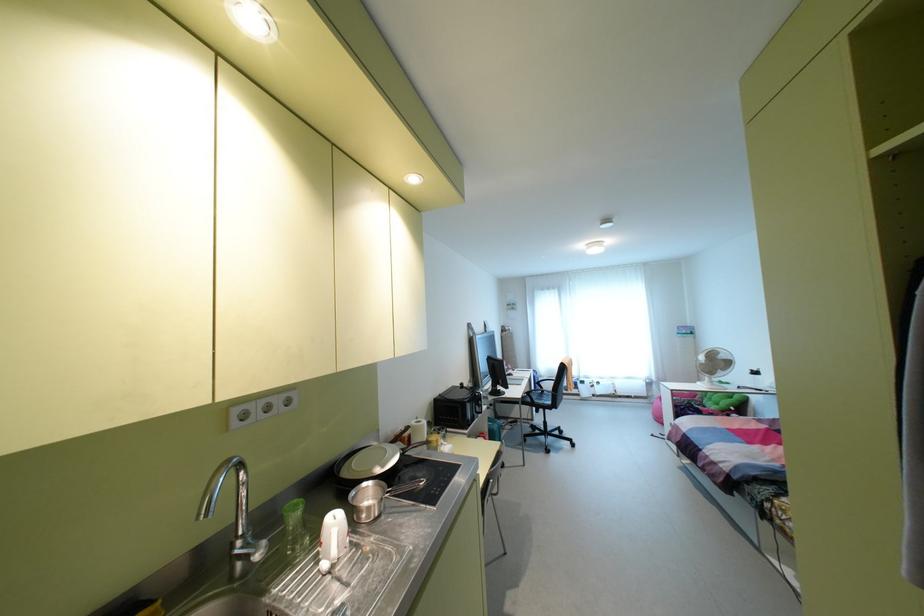
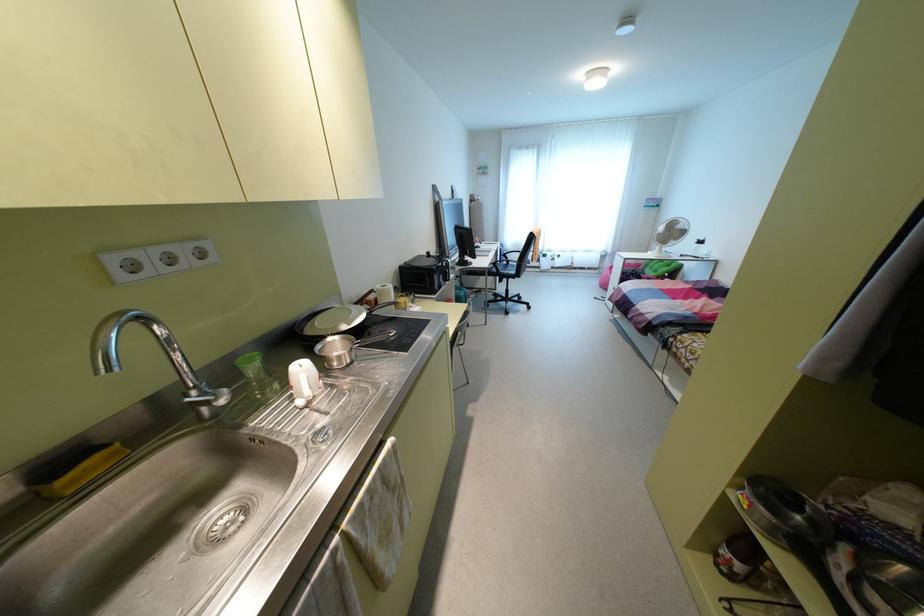
In the second image, find the point that corresponds to (241,535) in the first image.

(195, 387)